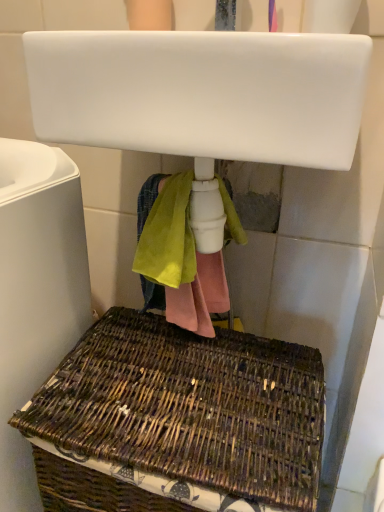
Question: Is woven brown basket at lower left not within white glossy sink at upper center?

Choices:
 (A) yes
 (B) no

Answer: (A)

Question: Does woven brown basket at lower left have a larger size compared to white glossy sink at upper center?

Choices:
 (A) yes
 (B) no

Answer: (A)

Question: Can you confirm if woven brown basket at lower left is positioned to the left of white glossy sink at upper center?

Choices:
 (A) no
 (B) yes

Answer: (B)

Question: Is the position of woven brown basket at lower left less distant than that of white glossy sink at upper center?

Choices:
 (A) yes
 (B) no

Answer: (B)

Question: Is woven brown basket at lower left turned away from white glossy sink at upper center?

Choices:
 (A) no
 (B) yes

Answer: (A)

Question: Based on their sizes in the image, would you say woven brown basket at lower left is bigger or smaller than white glossy sink at upper center?

Choices:
 (A) big
 (B) small

Answer: (A)

Question: Visually, is woven brown basket at lower left positioned to the left or to the right of white glossy sink at upper center?

Choices:
 (A) right
 (B) left

Answer: (B)

Question: Is woven brown basket at lower left taller or shorter than white glossy sink at upper center?

Choices:
 (A) tall
 (B) short

Answer: (A)

Question: From the image's perspective, is woven brown basket at lower left above or below white glossy sink at upper center?

Choices:
 (A) above
 (B) below

Answer: (B)

Question: From their relative heights in the image, would you say woven brown basket at lower left is taller or shorter than brown woven picnic basket at lower center?

Choices:
 (A) tall
 (B) short

Answer: (A)

Question: Is point (77, 225) positioned closer to the camera than point (51, 441)?

Choices:
 (A) farther
 (B) closer

Answer: (A)

Question: Considering the positions of woven brown basket at lower left and brown woven picnic basket at lower center in the image, is woven brown basket at lower left wider or thinner than brown woven picnic basket at lower center?

Choices:
 (A) wide
 (B) thin

Answer: (A)

Question: From the image's perspective, is woven brown basket at lower left above or below brown woven picnic basket at lower center?

Choices:
 (A) above
 (B) below

Answer: (A)

Question: Choose the correct answer: Is white glossy sink at upper center inside brown woven picnic basket at lower center or outside it?

Choices:
 (A) inside
 (B) outside

Answer: (B)

Question: Relative to brown woven picnic basket at lower center, is white glossy sink at upper center in front or behind?

Choices:
 (A) behind
 (B) front

Answer: (B)